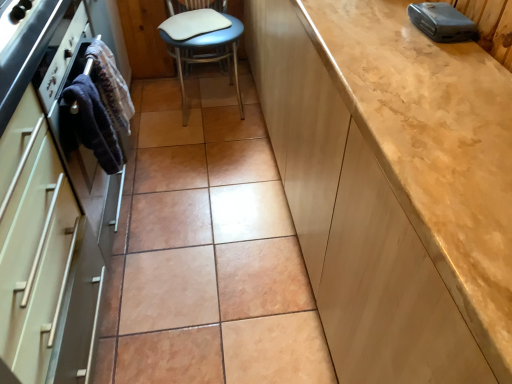
Question: From the image's perspective, is matte beige cabinet at right, marked as the first cabinetry in a right-to-left arrangement, positioned above or below white leather chair at center?

Choices:
 (A) below
 (B) above

Answer: (A)

Question: Is matte beige cabinet at right, marked as the first cabinetry in a right-to-left arrangement, taller or shorter than white leather chair at center?

Choices:
 (A) short
 (B) tall

Answer: (B)

Question: Which is farther from the matte beige cabinet at right, marked as the first cabinetry in a right-to-left arrangement?

Choices:
 (A) dark blue fabric at left, marked as the 2th material in a front-to-back arrangement
 (B) dark blue fabric towel at left, the 2th material positioned from the back
 (C) white leather chair at center
 (D) matte white oven at left, the second cabinetry viewed from the right

Answer: (C)

Question: Which object is the closest to the matte beige cabinet at right, marked as the 2th cabinetry in a left-to-right arrangement?

Choices:
 (A) dark blue fabric at left, marked as the 2th material in a front-to-back arrangement
 (B) matte white oven at left, the second cabinetry viewed from the right
 (C) dark blue fabric towel at left, the 1th material when ordered from front to back
 (D) white leather chair at center

Answer: (B)